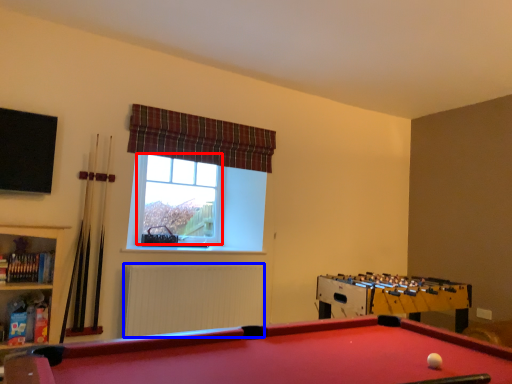
Question: Which of the following is the closest to the observer, bay window (highlighted by a red box) or radiator (highlighted by a blue box)?

Choices:
 (A) bay window
 (B) radiator

Answer: (B)